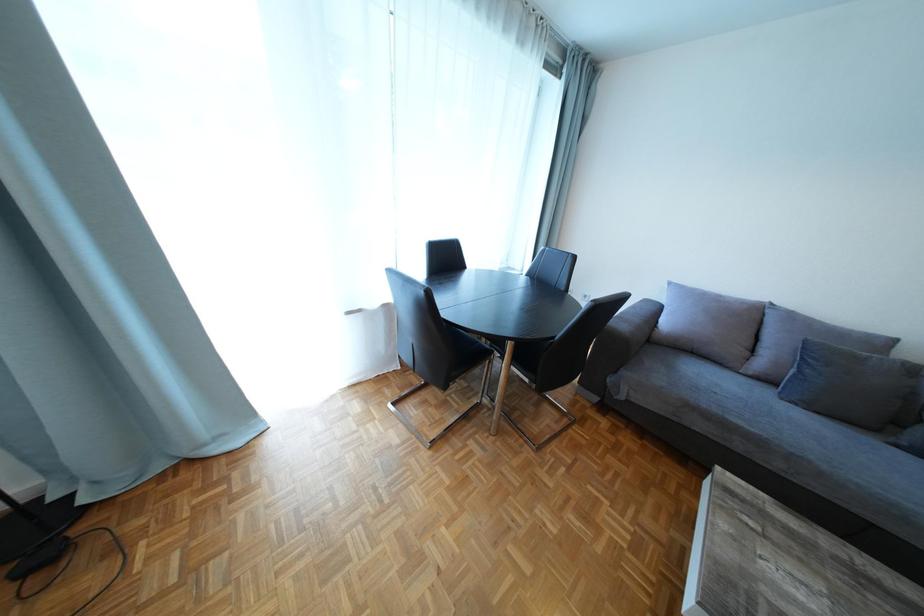
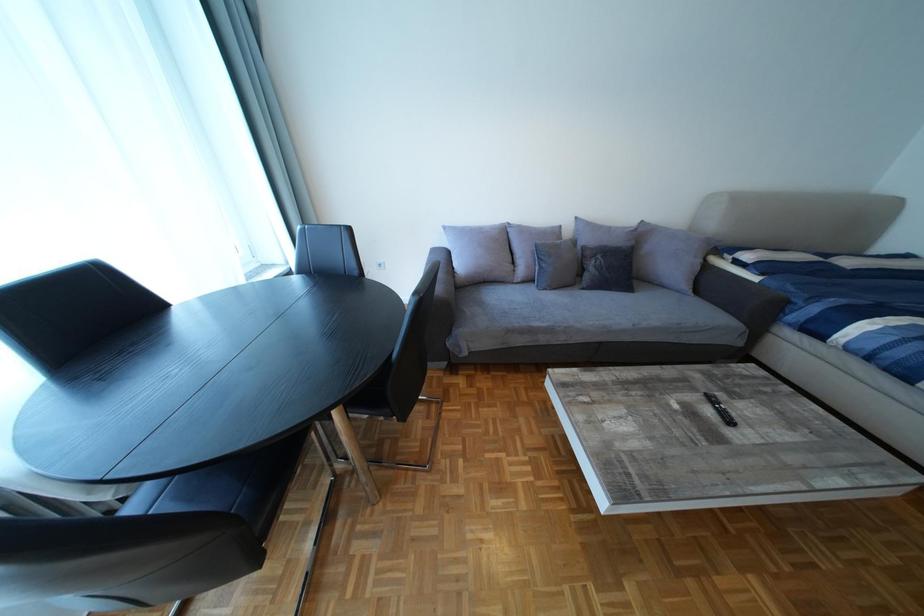
How did the camera likely rotate?

The camera rotated toward right-down.